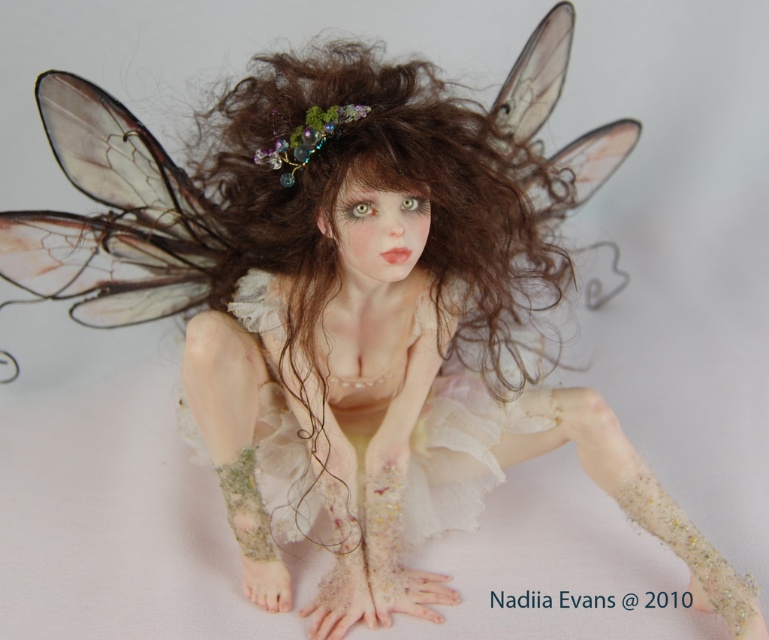
Question: Which of the following is the farthest from the observer?

Choices:
 (A) (365, 106)
 (B) (222, 493)

Answer: (B)

Question: Is translucent lace dress at center in front of translucent gemstone hair ornament at center?

Choices:
 (A) yes
 (B) no

Answer: (B)

Question: Is the position of translucent lace dress at center more distant than that of translucent gemstone hair ornament at center?

Choices:
 (A) no
 (B) yes

Answer: (B)

Question: Can you confirm if translucent lace dress at center is positioned above translucent gemstone hair ornament at center?

Choices:
 (A) no
 (B) yes

Answer: (A)